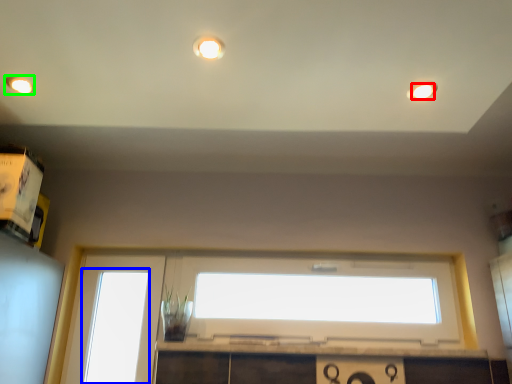
Question: Considering the real-world distances, which object is farthest from lighting (highlighted by a red box)? window (highlighted by a blue box) or lighting (highlighted by a green box)?

Choices:
 (A) window
 (B) lighting

Answer: (A)